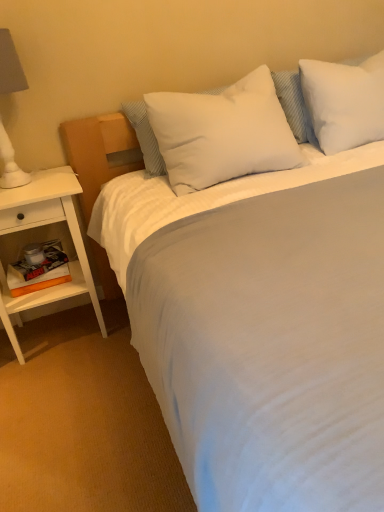
Question: Considering the positions of white wood nightstand at left and white matte lampshade at left in the image, is white wood nightstand at left taller or shorter than white matte lampshade at left?

Choices:
 (A) tall
 (B) short

Answer: (A)

Question: From a real-world perspective, is white wood nightstand at left above or below white matte lampshade at left?

Choices:
 (A) above
 (B) below

Answer: (B)

Question: Estimate the real-world distances between objects in this image. Which object is farther from the white soft pillow at center, arranged as the first pillow when viewed from the left?

Choices:
 (A) orange matte book at left
 (B) white soft pillow at upper right, which is the second pillow from left to right
 (C) white matte lampshade at left
 (D) white wood nightstand at left

Answer: (A)

Question: Estimate the real-world distances between objects in this image. Which object is farther from the white soft pillow at center, marked as the second pillow in a right-to-left arrangement?

Choices:
 (A) white soft pillow at upper right, which is the second pillow from left to right
 (B) white wood nightstand at left
 (C) orange matte book at left
 (D) white matte lampshade at left

Answer: (C)